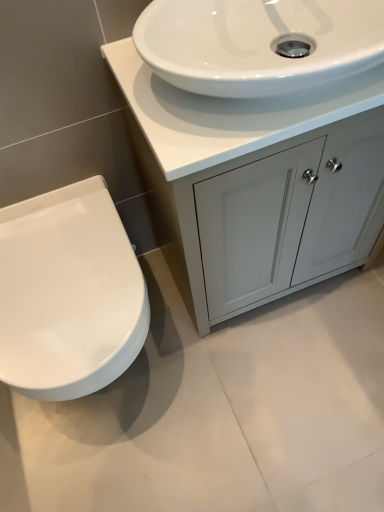
Find the location of a particular element. This screenshot has width=384, height=512. vacant area that is in front of matte white cabinet at center is located at coordinates (280, 387).